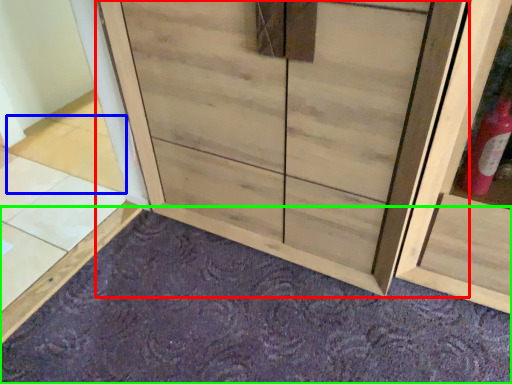
Question: Considering the real-world distances, which object is farthest from cupboard (highlighted by a red box)? tile (highlighted by a blue box) or plain (highlighted by a green box)?

Choices:
 (A) tile
 (B) plain

Answer: (A)